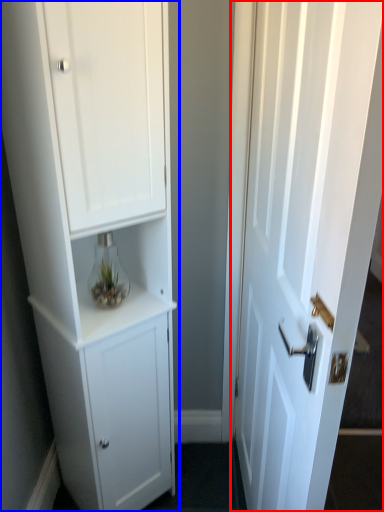
Question: Which object appears farthest to the camera in this image, door (highlighted by a red box) or cupboard (highlighted by a blue box)?

Choices:
 (A) door
 (B) cupboard

Answer: (B)